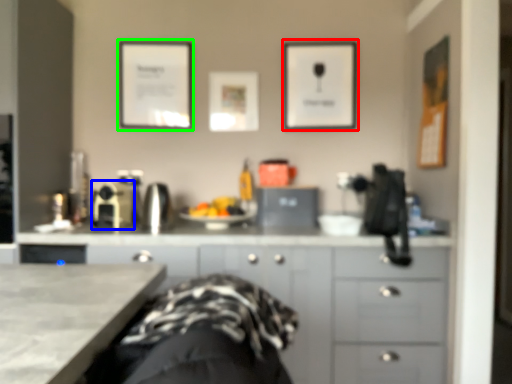
Question: Which is farther away from picture frame (highlighted by a red box)? appliance (highlighted by a blue box) or picture frame (highlighted by a green box)?

Choices:
 (A) appliance
 (B) picture frame

Answer: (A)